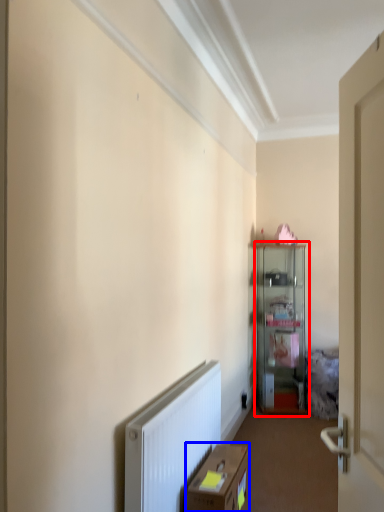
Question: Which object is further to the camera taking this photo, cabinetry (highlighted by a red box) or cardboard box (highlighted by a blue box)?

Choices:
 (A) cabinetry
 (B) cardboard box

Answer: (A)